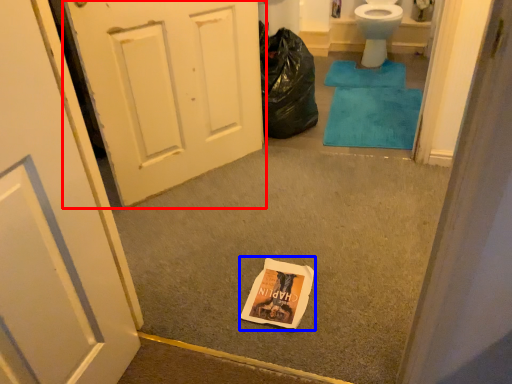
Question: Which point is closer to the camera, door (highlighted by a red box) or paperback book (highlighted by a blue box)?

Choices:
 (A) door
 (B) paperback book

Answer: (B)